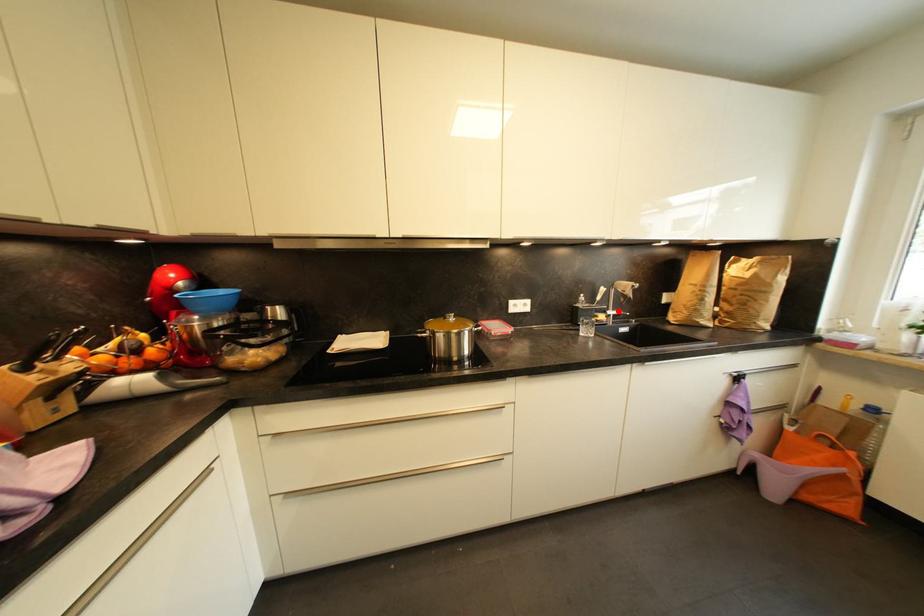
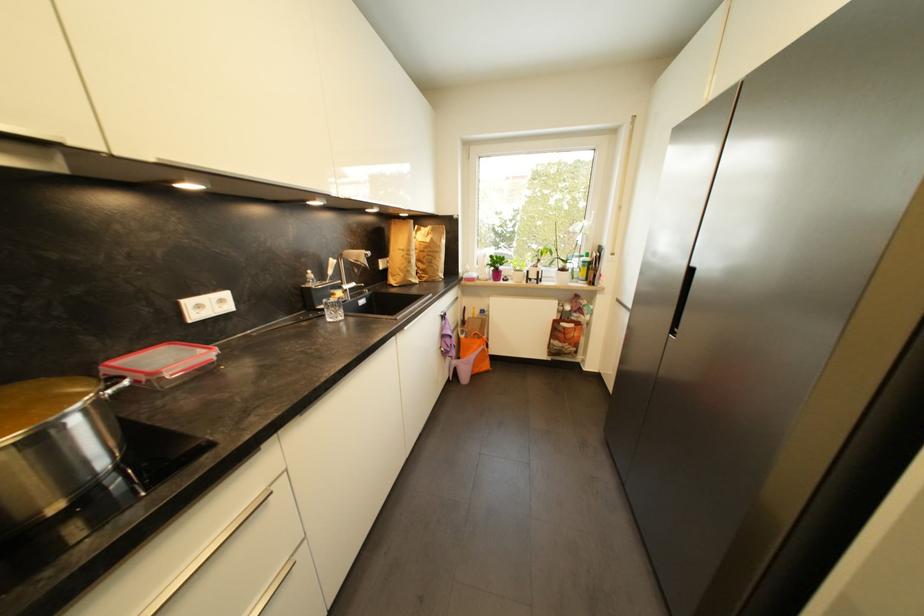
Question: I am providing you with two images of the same scene from different viewpoints. In image1, a red point is highlighted. Considering the same 3D point in image2, which of the following is correct?

Choices:
 (A) It is closer
 (B) It is farther

Answer: (A)